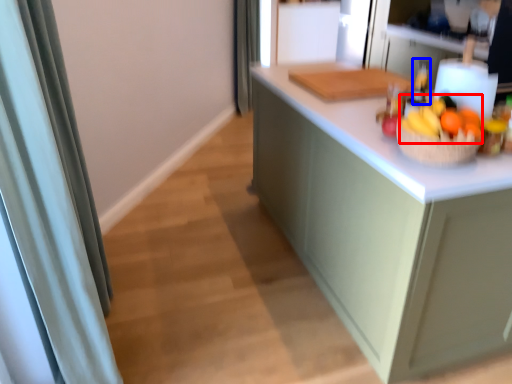
Question: Which object is closer to the camera taking this photo, fruit (highlighted by a red box) or bottle (highlighted by a blue box)?

Choices:
 (A) fruit
 (B) bottle

Answer: (A)